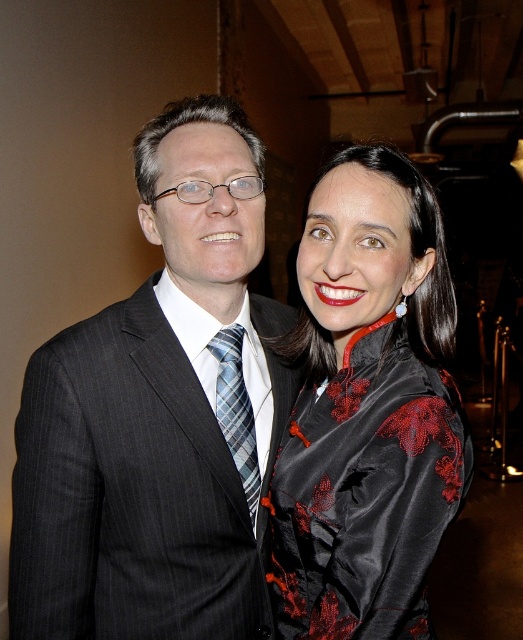
You are a photographer at a formal event. You need to place a small microphone stand at the point marked by coordinates point (x=158, y=413). The matte black suit at left is worn by a person. Will the microphone stand be placed near the person wearing the matte black suit at left?

The point (x=158, y=413) indicates the matte black suit at left, so yes, the microphone stand will be placed near the person wearing the matte black suit at left.